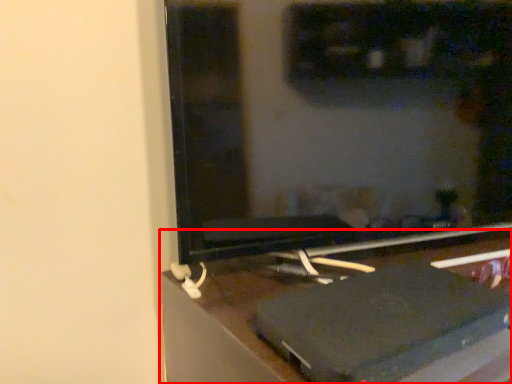
Question: Observing the image, what is the correct spatial positioning of furniture (annotated by the red box) in reference to computer monitor?

Choices:
 (A) left
 (B) right

Answer: (B)